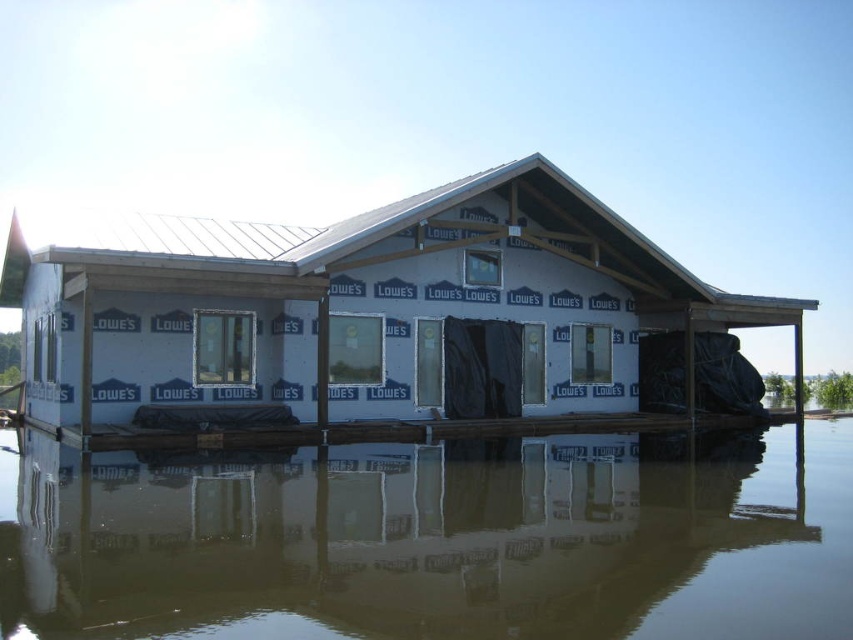
Is brown murky water at lower center wider than white foam dock at center?

Incorrect, brown murky water at lower center's width does not surpass white foam dock at center's.

Identify the location of brown murky water at lower center. (433, 540).